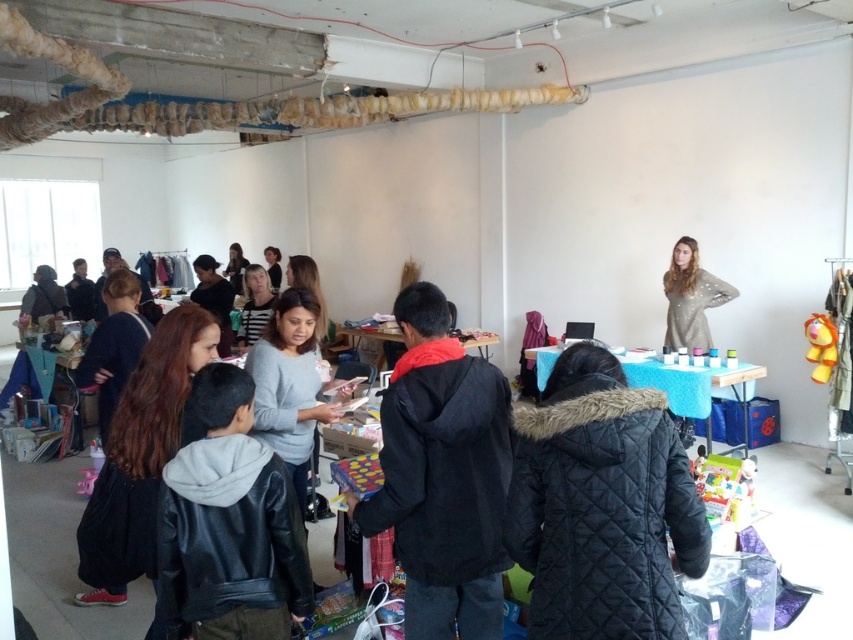
Question: Is dark brown leather jacket at lower left bigger than matte black jacket at center?

Choices:
 (A) no
 (B) yes

Answer: (B)

Question: Which point appears closest to the camera in this image?

Choices:
 (A) (260, 292)
 (B) (135, 508)
 (C) (299, 284)

Answer: (B)

Question: Among these points, which one is farthest from the camera?

Choices:
 (A) (107, 497)
 (B) (288, 289)
 (C) (231, 253)
 (D) (315, 324)

Answer: (C)

Question: Is dark brown leather jacket at lower left positioned before matte gray sweater at center?

Choices:
 (A) yes
 (B) no

Answer: (A)

Question: Is gray matte sweater at center further to the viewer compared to matte black jacket at center?

Choices:
 (A) no
 (B) yes

Answer: (A)

Question: Which object appears closest to the camera in this image?

Choices:
 (A) striped shirt at center
 (B) black quilted coat at lower center
 (C) matte gray sweater at center

Answer: (B)